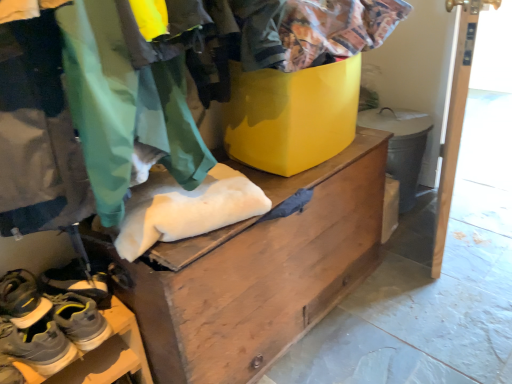
Question: Relative to gray suede sneakers at lower left, the 3th footwear positioned from the bottom, is white wood door at right in front or behind?

Choices:
 (A) behind
 (B) front

Answer: (A)

Question: From a real-world perspective, is white wood door at right positioned above or below gray suede sneakers at lower left, the 3th footwear positioned from the bottom?

Choices:
 (A) below
 (B) above

Answer: (B)

Question: Which object is positioned closest to the camouflage fabric pants at lower left?

Choices:
 (A) gray rubber shoes at lower left
 (B) gray suede sneakers at lower left, the 1th footwear viewed from the top
 (C) wooden chest at center
 (D) white wood door at right
 (E) gray suede sneakers at lower left, which is the 1th footwear in bottom-to-top order

Answer: (C)

Question: Based on their relative distances, which object is farther from the gray rubber shoes at lower left?

Choices:
 (A) wooden chest at center
 (B) camouflage fabric pants at lower left
 (C) gray suede sneakers at lower left, the 2th footwear when ordered from top to bottom
 (D) white wood door at right
 (E) gray suede sneakers at lower left, the 1th footwear viewed from the top

Answer: (D)